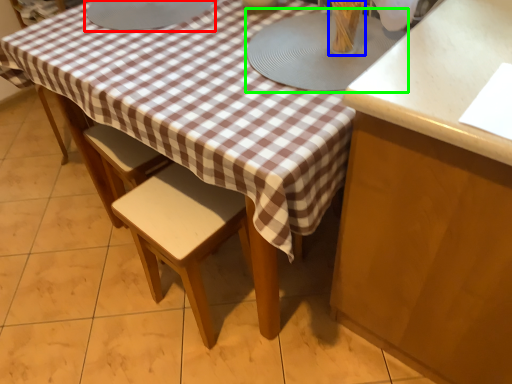
Question: Considering the real-world distances, which object is farthest from round table (highlighted by a red box)? tableware (highlighted by a blue box) or round table (highlighted by a green box)?

Choices:
 (A) tableware
 (B) round table

Answer: (A)